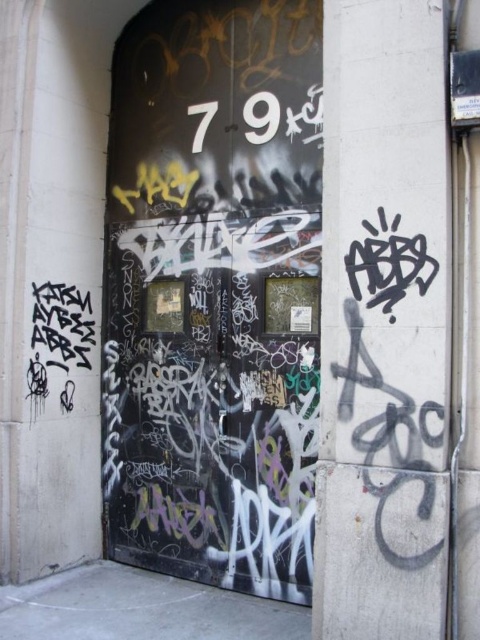
Does black textured door at center have a larger size compared to grungy concrete pillar at center?

Yes, black textured door at center is bigger than grungy concrete pillar at center.

Measure the distance between point [124,342] and camera.

Point [124,342] and camera are 4.35 meters apart from each other.

The image size is (480, 640). Describe the element at coordinates (214, 292) in the screenshot. I see `black textured door at center` at that location.

Locate an element on the screen. black textured door at center is located at coordinates (214, 292).